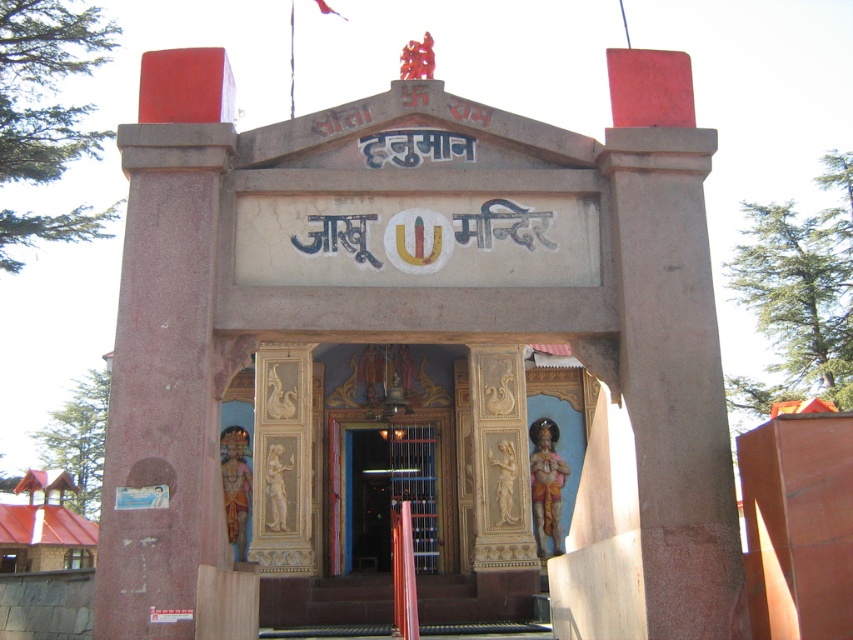
Which is in front, point (666, 220) or point (389, 477)?

Point (666, 220)

Is point (480, 241) less distant than point (364, 460)?

Yes, point (480, 241) is in front of point (364, 460).

You are a GUI agent. You are given a task and a screenshot of the screen. Output one action in this format:
    pyautogui.click(x=<x>, y=<y>)
    Task: Click on the smooth stone hindu temple at center
    The height and width of the screenshot is (640, 853).
    Given the screenshot: What is the action you would take?
    pyautogui.click(x=409, y=339)

Identify the location of smooth stone stairs at center. The image size is (853, 640). (328, 602).

Can you confirm if smooth stone stairs at center is bigger than wooden door at center?

Yes, smooth stone stairs at center is bigger than wooden door at center.

Is point (282, 611) positioned in front of point (392, 490)?

Yes.

Find the location of `smooth stone stairs at center`. smooth stone stairs at center is located at coordinates (328, 602).

Is smooth stone hindu temple at center behind smooth stone stairs at center?

No.

Who is lower down, smooth stone hindu temple at center or smooth stone stairs at center?

smooth stone stairs at center is below.

Is point (659, 355) more distant than point (524, 572)?

No, (659, 355) is in front of (524, 572).

At what (x,y) coordinates should I click in order to perform the action: click on smooth stone hindu temple at center. Please return your answer as a coordinate pair (x, y). This screenshot has height=640, width=853. Looking at the image, I should click on (409, 339).